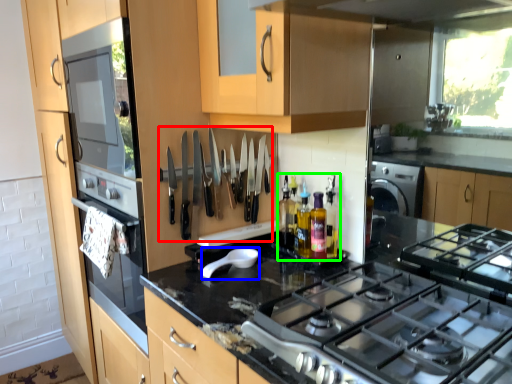
Question: Based on their relative distances, which object is nearer to cutlery (highlighted by a red box)? Choose from appliance (highlighted by a blue box) and bottle (highlighted by a green box).

Choices:
 (A) appliance
 (B) bottle

Answer: (A)